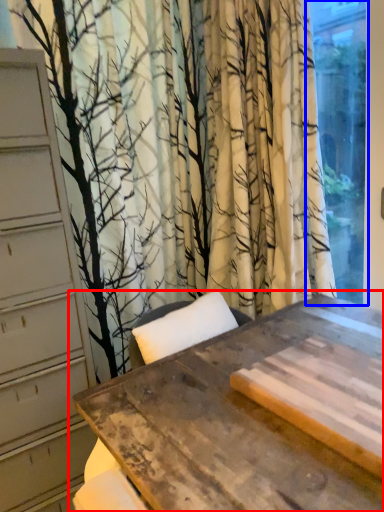
Question: Which object appears farthest to the camera in this image, table (highlighted by a red box) or window (highlighted by a blue box)?

Choices:
 (A) table
 (B) window

Answer: (B)